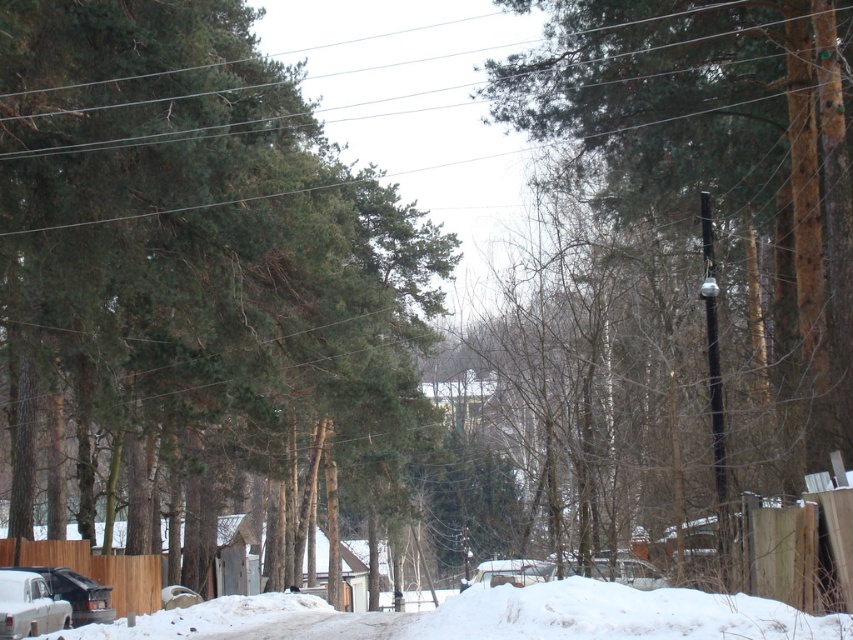
Does brown rough tree at center have a greater width compared to matte black car at lower left?

Yes.

Locate an element on the screen. brown rough tree at center is located at coordinates (718, 150).

Who is positioned more to the left, white fluffy snow at lower left or white matte car at center?

From the viewer's perspective, white fluffy snow at lower left appears more on the left side.

Is white fluffy snow at lower left closer to the viewer compared to white matte car at center?

Yes.

Is point (608, 600) positioned before point (485, 582)?

That is True.

Identify the location of white fluffy snow at lower left. (490, 618).

Between snow-covered sedan at lower left and matte black car at lower left, which one has less height?

Standing shorter between the two is matte black car at lower left.

Between snow-covered sedan at lower left and matte black car at lower left, which one appears on the left side from the viewer's perspective?

matte black car at lower left is more to the left.

At what (x,y) coordinates should I click in order to perform the action: click on snow-covered sedan at lower left. Please return your answer as a coordinate pair (x, y). Looking at the image, I should click on (28, 605).

Where is `snow-covered sedan at lower left`? snow-covered sedan at lower left is located at coordinates (28, 605).